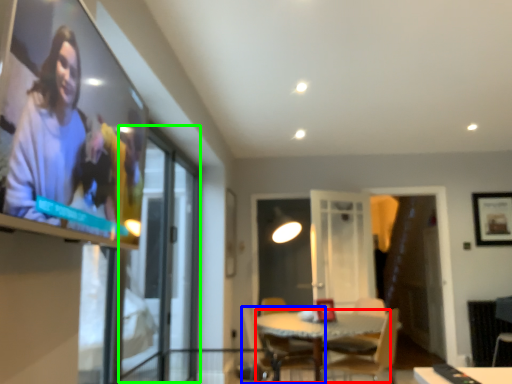
Question: Which object is the farthest from glass table (highlighted by a red box)? Choose among these: chair (highlighted by a blue box) or screen door (highlighted by a green box).

Choices:
 (A) chair
 (B) screen door

Answer: (B)